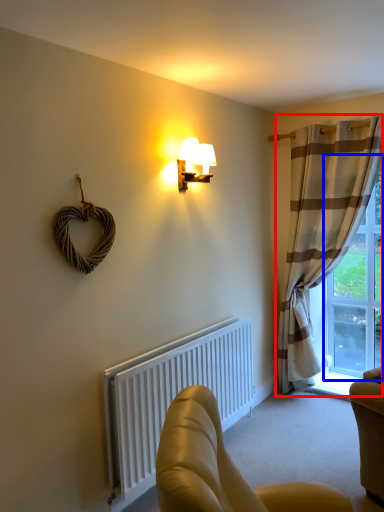
Question: Which point is further to the camera, curtain (highlighted by a red box) or window (highlighted by a blue box)?

Choices:
 (A) curtain
 (B) window

Answer: (B)